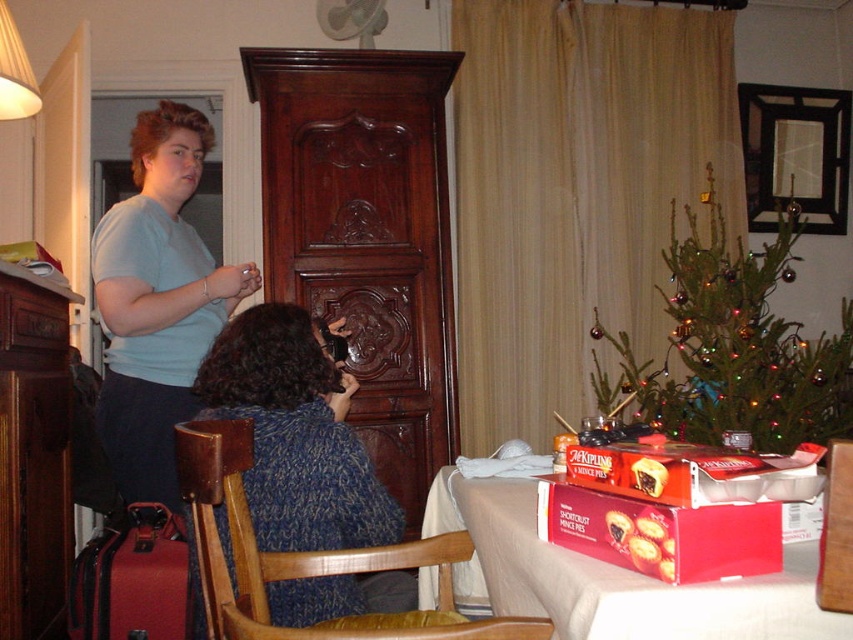
Consider the image. You are a photographer setting up a shoot in this scene. You need to ensure that the blue knitted sweater at center and the white cloth table at lower right are both visible in the frame. Given their sizes, which object should be placed closer to the camera to maintain both in focus?

The blue knitted sweater at center is taller than the white cloth table at lower right, so to keep both in focus, the taller blue knitted sweater at center should be placed closer to the camera.

Based on the photo, you are a delivery person who needs to place a small package on the white cloth table at lower right. You are currently standing next to the blue knitted sweater at center. Can you reach the table without moving the sweater or yourself?

The distance between the blue knitted sweater at center and the white cloth table at lower right is 14.15 inches. Since the package is small, you can likely reach it without moving either object.

You are a photographer trying to capture a photo of the green matte christmas tree at right and the white cloth table at lower right. Which object should you focus on first to ensure it appears sharp in the photo?

The green matte christmas tree at right is further to the viewer than the white cloth table at lower right, so you should focus on the green matte christmas tree at right first to ensure it appears sharp in the photo.